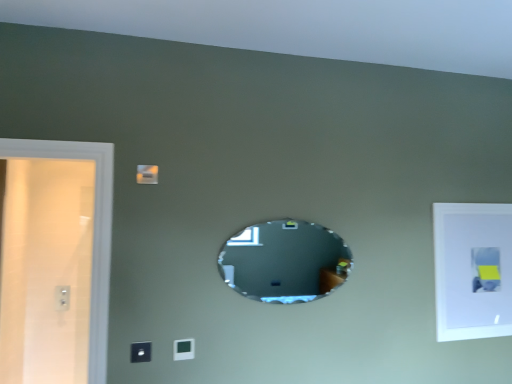
Question: Is oval mirror at center smaller than white matte picture frame at upper right?

Choices:
 (A) no
 (B) yes

Answer: (A)

Question: Does oval mirror at center appear on the right side of white matte picture frame at upper right?

Choices:
 (A) yes
 (B) no

Answer: (B)

Question: Is the position of oval mirror at center more distant than that of white matte picture frame at upper right?

Choices:
 (A) yes
 (B) no

Answer: (B)

Question: From a real-world perspective, is oval mirror at center located beneath white matte picture frame at upper right?

Choices:
 (A) yes
 (B) no

Answer: (B)

Question: Does oval mirror at center have a lesser height compared to white matte picture frame at upper right?

Choices:
 (A) yes
 (B) no

Answer: (A)

Question: Which is correct: matte white light switch at lower center, marked as the first light switch in a back-to-front arrangement, is inside oval mirror at center, or outside of it?

Choices:
 (A) inside
 (B) outside

Answer: (B)

Question: Considering the positions of point (184, 355) and point (283, 297), is point (184, 355) closer or farther from the camera than point (283, 297)?

Choices:
 (A) farther
 (B) closer

Answer: (B)

Question: Is matte white light switch at lower center, positioned as the 2th light switch in front-to-back order, taller or shorter than oval mirror at center?

Choices:
 (A) tall
 (B) short

Answer: (B)

Question: From the image's perspective, relative to oval mirror at center, is matte white light switch at lower center, which appears as the 1th light switch when viewed from the right, above or below?

Choices:
 (A) below
 (B) above

Answer: (A)

Question: In the image, is white plastic electric outlet at left positioned in front of or behind matte white light switch at lower center, positioned as the 2th light switch in front-to-back order?

Choices:
 (A) behind
 (B) front

Answer: (A)

Question: Based on their positions, is white plastic electric outlet at left located to the left or right of matte white light switch at lower center, which ranks as the second light switch in left-to-right order?

Choices:
 (A) right
 (B) left

Answer: (B)

Question: From a real-world perspective, relative to matte white light switch at lower center, marked as the first light switch in a back-to-front arrangement, is white plastic electric outlet at left vertically above or below?

Choices:
 (A) above
 (B) below

Answer: (B)

Question: Is white plastic electric outlet at left bigger or smaller than matte white light switch at lower center, positioned as the 2th light switch in front-to-back order?

Choices:
 (A) small
 (B) big

Answer: (B)

Question: From the image's perspective, is oval mirror at center positioned above or below satin black switch at lower center, the 2th light switch from the back?

Choices:
 (A) above
 (B) below

Answer: (A)

Question: From their relative heights in the image, would you say oval mirror at center is taller or shorter than satin black switch at lower center, which appears as the first light switch when viewed from the front?

Choices:
 (A) short
 (B) tall

Answer: (B)